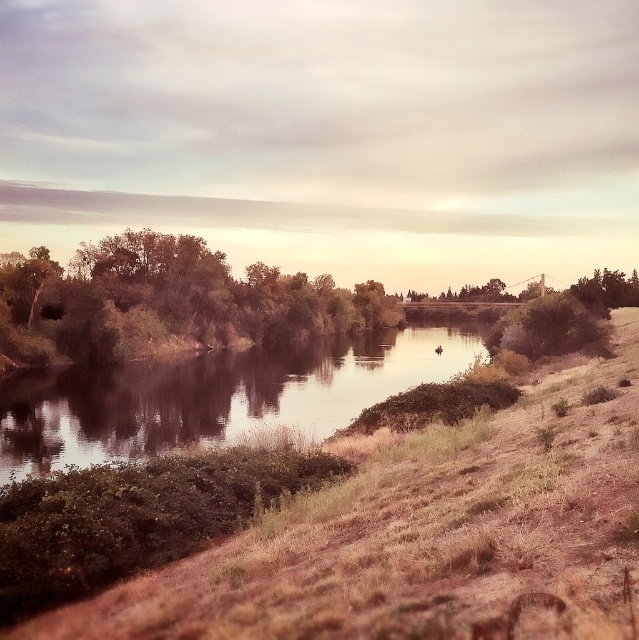
You are standing on the riverside and want to take a photo of the smooth reflective water at center and the green leafy trees at left. Which object should you focus on first if you want to capture both in one frame without moving the camera?

You should focus on the green leafy trees at left first because the smooth reflective water at center is positioned under it, so adjusting the camera angle to include both might require ensuring the trees are in the upper part of the frame while the water remains centered below.

You are standing on the riverside path and see both the green leafy bush at right and the green leafy tree at right. Which one would you have to look at first if you are looking towards the river?

The green leafy bush at right is closer to the viewer than the green leafy tree at right, so you would see the green leafy bush at right first when looking towards the river.